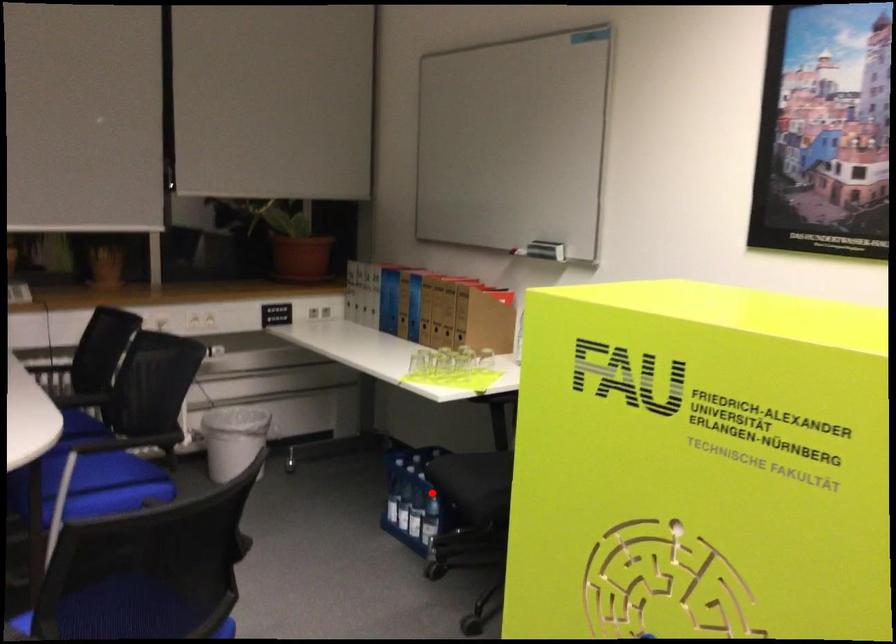
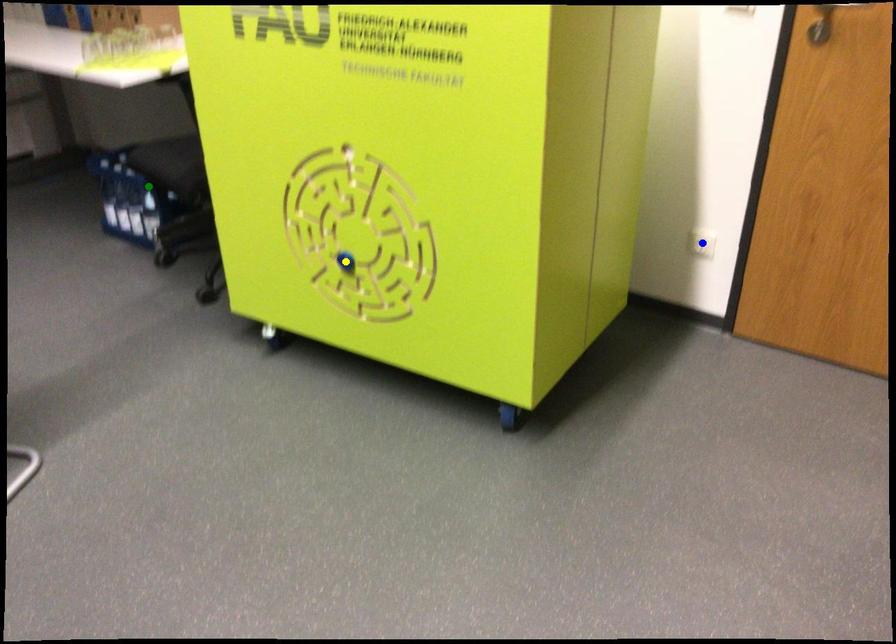
Question: I am providing you with two images of the same scene from different viewpoints. A red point is marked on the first image. You are given multiple points on the second image. Which mark in image 2 goes with the point in image 1?

Choices:
 (A) blue point
 (B) yellow point
 (C) green point

Answer: (C)